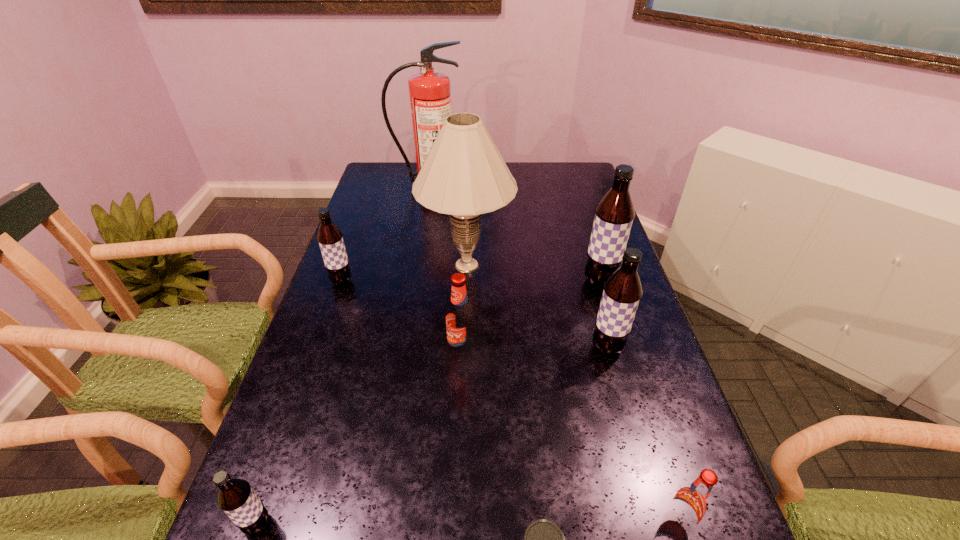
In order to click on empty location between the fifth shortest root beer and the third biggest brown root beer in this screenshot , I will do (x=474, y=315).

Image resolution: width=960 pixels, height=540 pixels. I want to click on unoccupied position between the second smallest brown root beer and the second biggest brown root beer, so click(x=474, y=315).

Where is `free space that is in between the beige lampshade and the nearest brown root beer`? This screenshot has width=960, height=540. free space that is in between the beige lampshade and the nearest brown root beer is located at coordinates (362, 395).

The width and height of the screenshot is (960, 540). I want to click on free space between the beige lampshade and the second biggest brown root beer, so click(537, 307).

The height and width of the screenshot is (540, 960). Identify the location of free space between the left red root beer and the fire extinguisher. (444, 268).

Image resolution: width=960 pixels, height=540 pixels. I want to click on unoccupied area between the second smallest brown root beer and the red fire extinguisher, so click(385, 233).

Locate which object ranks seventh in proximity to the nearer red root beer. Please provide its 2D coordinates. Your answer should be formatted as a tuple, i.e. [(x, y)], where the tuple contains the x and y coordinates of a point satisfying the conditions above.

[(330, 238)]

Identify which object is the closest to the third root beer from left to right. Please provide its 2D coordinates. Your answer should be formatted as a tuple, i.e. [(x, y)], where the tuple contains the x and y coordinates of a point satisfying the conditions above.

[(463, 175)]

Identify which root beer is the nearest to the right red root beer. Please provide its 2D coordinates. Your answer should be formatted as a tuple, i.e. [(x, y)], where the tuple contains the x and y coordinates of a point satisfying the conditions above.

[(622, 292)]

At what (x,y) coordinates should I click in order to perform the action: click on root beer that is the fourth closest to the farther red root beer. Please return your answer as a coordinate pair (x, y). The image size is (960, 540). Looking at the image, I should click on (236, 498).